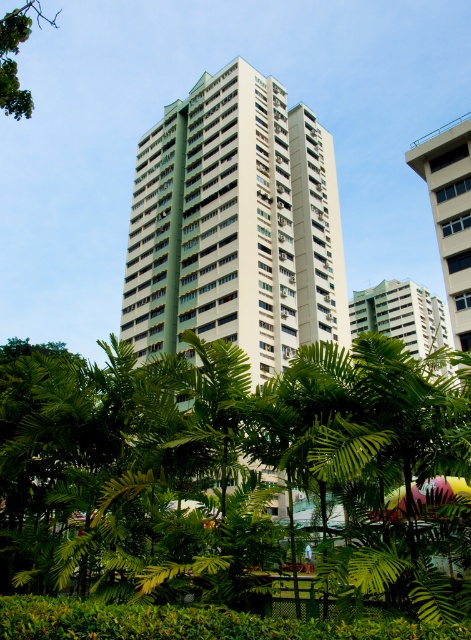
Describe the element at coordinates (402, 316) in the screenshot. I see `green matte building at upper center` at that location.

Who is more distant from viewer, (430, 339) or (16, 20)?

The point (430, 339) is behind.

Locate an element on the screen. This screenshot has height=640, width=471. green matte building at upper center is located at coordinates (402, 316).

Measure the distance between white concrete building at upper right and green leafy tree at upper left.

white concrete building at upper right and green leafy tree at upper left are 113.16 meters apart.

Does white concrete building at upper right appear over green leafy tree at upper left?

No.

You are a GUI agent. You are given a task and a screenshot of the screen. Output one action in this format:
    pyautogui.click(x=<x>, y=<y>)
    Task: Click on the white concrete building at upper right
    
    Given the screenshot: What is the action you would take?
    pyautogui.click(x=449, y=212)

This screenshot has width=471, height=640. What are the coordinates of `white concrete building at upper right` in the screenshot? It's located at (449, 212).

Is green leafy tree at center thinner than green matte building at upper center?

Indeed, green leafy tree at center has a lesser width compared to green matte building at upper center.

Does green leafy tree at center have a lesser height compared to green matte building at upper center?

Yes, green leafy tree at center is shorter than green matte building at upper center.

Which is in front, point (45, 540) or point (428, 317)?

Positioned in front is point (45, 540).

Identify the location of green leafy tree at center. [x=235, y=474].